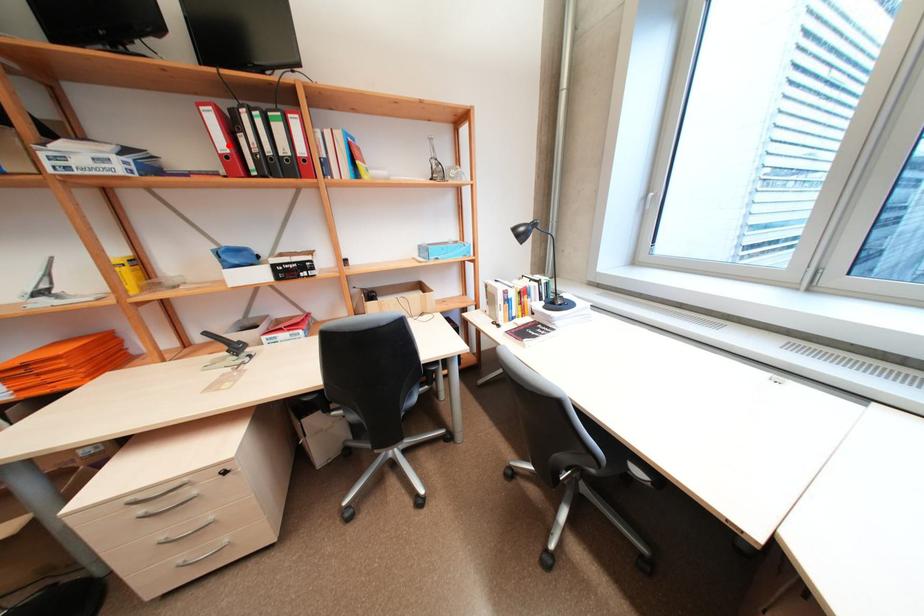
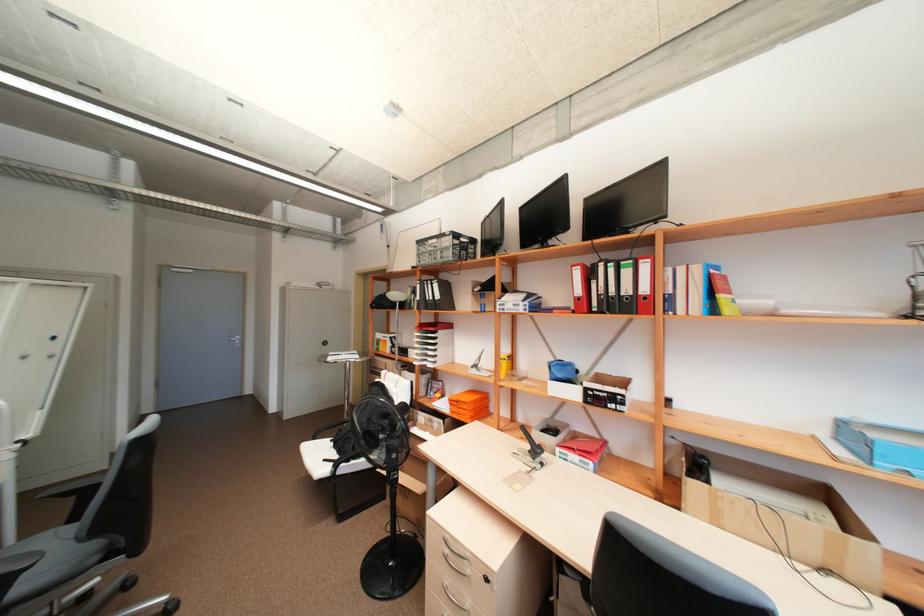
Where in the second image is the point corresponding to the highlighted location from the first image?

(584, 291)